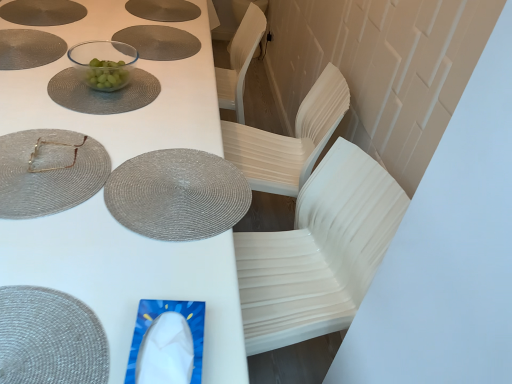
Question: From the image's perspective, is white plastic table at center on top of clear glass bowl at upper center, marked as the first tableware in a back-to-front arrangement?

Choices:
 (A) yes
 (B) no

Answer: (B)

Question: Considering the relative sizes of white plastic table at center and clear glass bowl at upper center, marked as the first tableware in a back-to-front arrangement, in the image provided, is white plastic table at center smaller than clear glass bowl at upper center, marked as the first tableware in a back-to-front arrangement,?

Choices:
 (A) no
 (B) yes

Answer: (A)

Question: Are white plastic table at center and clear glass bowl at upper center, marked as the first tableware in a back-to-front arrangement, beside each other?

Choices:
 (A) no
 (B) yes

Answer: (A)

Question: Is white plastic table at center further to the viewer compared to clear glass bowl at upper center, marked as the 1th tableware in a top-to-bottom arrangement?

Choices:
 (A) no
 (B) yes

Answer: (A)

Question: From the image's perspective, does white plastic table at center appear lower than clear glass bowl at upper center, marked as the first tableware in a back-to-front arrangement?

Choices:
 (A) no
 (B) yes

Answer: (B)

Question: From the image's perspective, relative to matte gray placemat at upper center, which is counted as the 2th platter, starting from the left, is matte silver placemat at upper left, the 2th platter viewed from the right, above or below?

Choices:
 (A) above
 (B) below

Answer: (B)

Question: From a real-world perspective, is matte silver placemat at upper left, the 2th platter viewed from the right, positioned above or below matte gray placemat at upper center, which is counted as the 2th platter, starting from the left?

Choices:
 (A) above
 (B) below

Answer: (A)

Question: Considering the positions of point (34, 9) and point (165, 11), is point (34, 9) closer or farther from the camera than point (165, 11)?

Choices:
 (A) farther
 (B) closer

Answer: (B)

Question: Choose the correct answer: Is matte silver placemat at upper left, the 1th platter in the left-to-right sequence, inside matte gray placemat at upper center, which is counted as the 2th platter, starting from the left, or outside it?

Choices:
 (A) outside
 (B) inside

Answer: (A)

Question: From the image's perspective, is white plastic table at center located above or below gold metallic square at upper left, the 2th tableware when ordered from back to front?

Choices:
 (A) above
 (B) below

Answer: (A)

Question: Is white plastic table at center wider or thinner than gold metallic square at upper left, the 2th tableware when ordered from top to bottom?

Choices:
 (A) wide
 (B) thin

Answer: (A)

Question: Considering the positions of white plastic table at center and gold metallic square at upper left, placed as the 3th tableware when sorted from bottom to top, in the image, is white plastic table at center taller or shorter than gold metallic square at upper left, placed as the 3th tableware when sorted from bottom to top,?

Choices:
 (A) short
 (B) tall

Answer: (B)

Question: Choose the correct answer: Is white plastic table at center inside gold metallic square at upper left, the 2th tableware when ordered from top to bottom, or outside it?

Choices:
 (A) inside
 (B) outside

Answer: (B)

Question: From the image's perspective, is transparent glass bowl at upper center, which is the second glass plate from front to back, located above or below matte silver placemat at upper left, the 2th platter viewed from the right?

Choices:
 (A) above
 (B) below

Answer: (B)

Question: In terms of height, does transparent glass bowl at upper center, the 1th glass plate positioned from the top, look taller or shorter compared to matte silver placemat at upper left, the 1th platter in the left-to-right sequence?

Choices:
 (A) short
 (B) tall

Answer: (A)